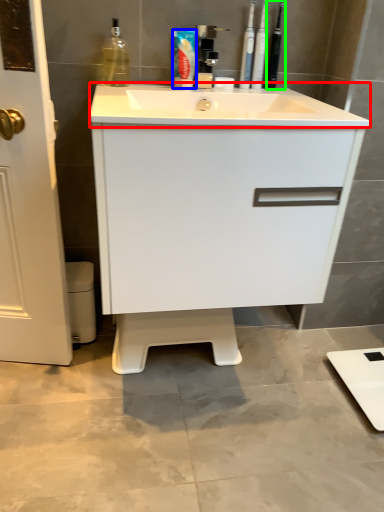
Question: Which object is the farthest from counter top (highlighted by a red box)? Choose among these: toothpaste (highlighted by a blue box) or toiletry (highlighted by a green box).

Choices:
 (A) toothpaste
 (B) toiletry

Answer: (B)